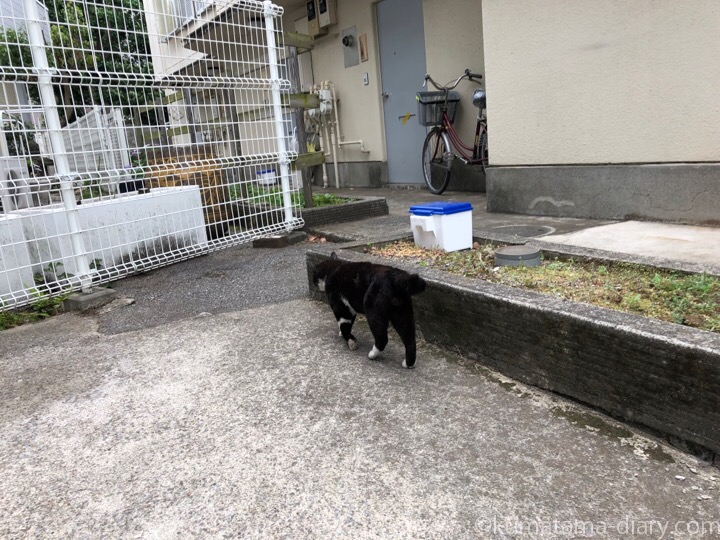
Find the location of a particular element. door is located at coordinates pyautogui.click(x=409, y=45).